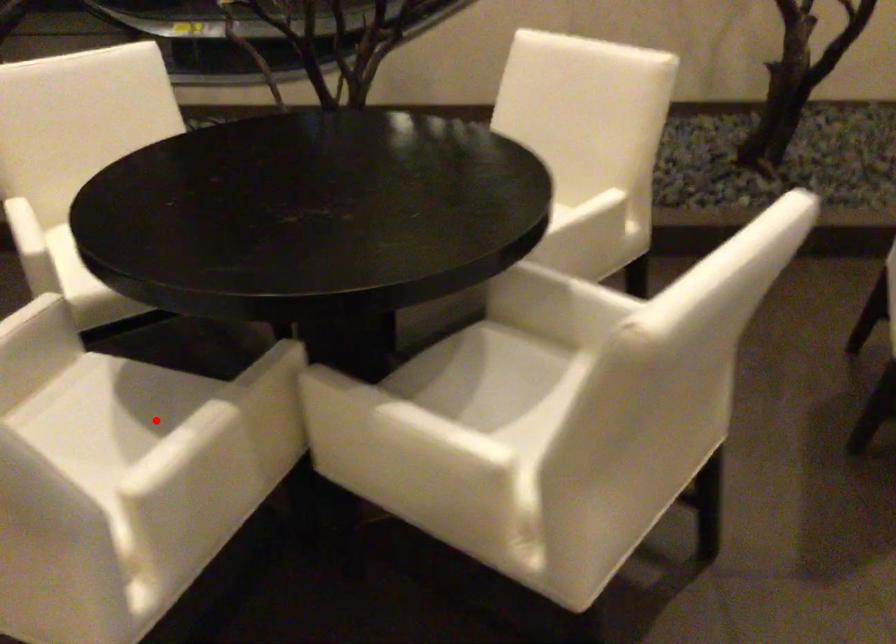
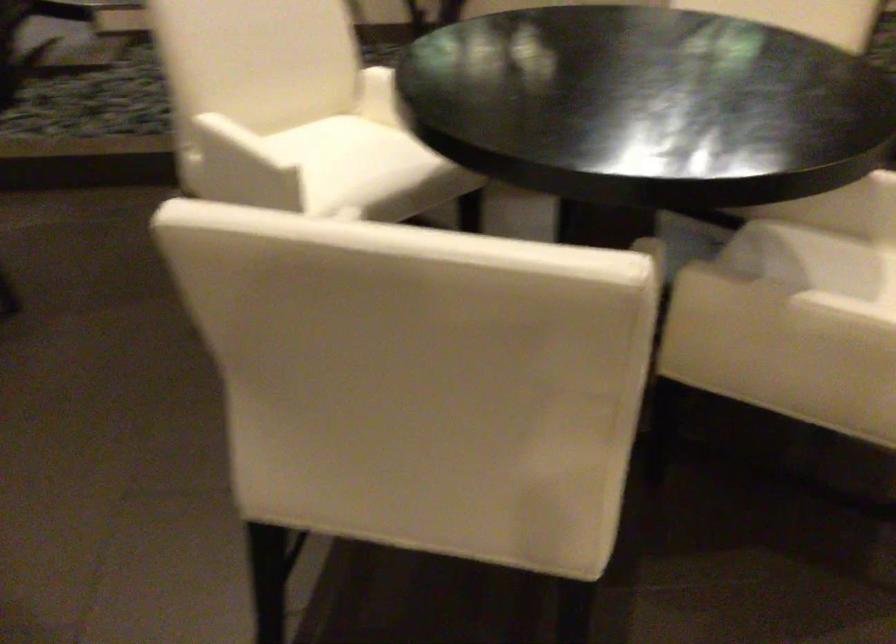
Question: I am providing you with two images of the same scene from different viewpoints. A red point is marked on the first image. Can you still see the location of the red point in image 2?

Choices:
 (A) Yes
 (B) No

Answer: (B)